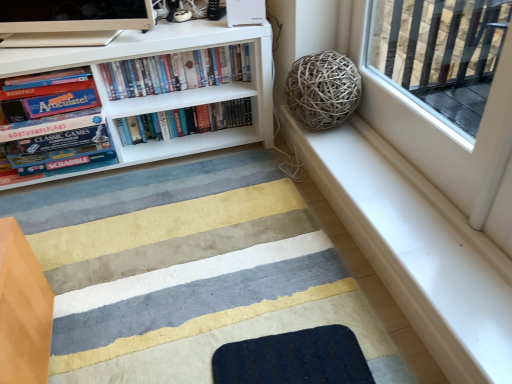
At what (x,y) coordinates should I click in order to perform the action: click on dark blue textured mat at lower center, which is the second doormat in front-to-back order. Please return your answer as a coordinate pair (x, y). The image size is (512, 384). Looking at the image, I should click on (294, 359).

How much space does dark blue textured mat at lower center, which is the second doormat in front-to-back order, occupy vertically?

1.82 centimeters.

What is the approximate width of white matte bookcase at upper left?

The width of white matte bookcase at upper left is 14.73 inches.

Identify the location of hardcover books at center, the 1th book viewed from the right. (188, 120).

Describe the element at coordinates (54, 125) in the screenshot. I see `matte board game at left, the third book in the right-to-left sequence` at that location.

Where is `dark blue textured mat at lower center, which ranks as the first doormat in back-to-front order`? The width and height of the screenshot is (512, 384). dark blue textured mat at lower center, which ranks as the first doormat in back-to-front order is located at coordinates (294, 359).

Is hardcover books at center, which is the third book from left to right, shorter than dark blue textured mat at lower center, which is the second doormat in front-to-back order?

Incorrect, the height of hardcover books at center, which is the third book from left to right, does not fall short of that of dark blue textured mat at lower center, which is the second doormat in front-to-back order.

From the image's perspective, which object appears higher, hardcover books at center, the 1th book viewed from the right, or dark blue textured mat at lower center, which ranks as the first doormat in back-to-front order?

hardcover books at center, the 1th book viewed from the right.

Can you confirm if hardcover books at center, the 1th book viewed from the right, is wider than dark blue textured mat at lower center, which ranks as the first doormat in back-to-front order?

Incorrect, the width of hardcover books at center, the 1th book viewed from the right, does not surpass that of dark blue textured mat at lower center, which ranks as the first doormat in back-to-front order.

Which object is further away from the camera, hardcover books at center, which is the third book from left to right, or dark blue textured mat at lower center, which is the second doormat in front-to-back order?

hardcover books at center, which is the third book from left to right.

Can you confirm if matte board game at left, the third book in the right-to-left sequence, is smaller than white matte bookcase at upper left?

Yes, matte board game at left, the third book in the right-to-left sequence, is smaller than white matte bookcase at upper left.

Which of these two, matte board game at left, the third book in the right-to-left sequence, or white matte bookcase at upper left, stands taller?

white matte bookcase at upper left is taller.

How different are the orientations of matte board game at left, arranged as the 1th book when viewed from the left, and white matte bookcase at upper left in degrees?

The angular difference between matte board game at left, arranged as the 1th book when viewed from the left, and white matte bookcase at upper left is 1.46 degrees.

Does point (105, 114) lie in front of point (112, 139)?

Yes, it is in front of point (112, 139).

From a real-world perspective, starting from the matte board game at left, arranged as the 1th book when viewed from the left, which doormat is the 2nd one below it? Please provide its 2D coordinates.

[(187, 270)]

Does matte board game at left, arranged as the 1th book when viewed from the left, have a lesser width compared to textured wool doormat at lower center, placed as the first doormat when sorted from front to back?

Correct, the width of matte board game at left, arranged as the 1th book when viewed from the left, is less than that of textured wool doormat at lower center, placed as the first doormat when sorted from front to back.

Between matte board game at left, arranged as the 1th book when viewed from the left, and textured wool doormat at lower center, placed as the first doormat when sorted from front to back, which one appears on the right side from the viewer's perspective?

textured wool doormat at lower center, placed as the first doormat when sorted from front to back.

Is point (158, 243) farther from viewer compared to point (78, 159)?

That is False.

Who is bigger, textured wool doormat at lower center, which is the second doormat in back-to-front order, or matte board game at left, arranged as the 1th book when viewed from the left?

Bigger between the two is matte board game at left, arranged as the 1th book when viewed from the left.

The image size is (512, 384). What are the coordinates of `the 3rd book counting from the left of the textured wool doormat at lower center, which is the second doormat in back-to-front order` in the screenshot? It's located at (54, 125).

Who is taller, textured wool doormat at lower center, which is the second doormat in back-to-front order, or matte board game at left, arranged as the 1th book when viewed from the left?

With more height is matte board game at left, arranged as the 1th book when viewed from the left.

The image size is (512, 384). What are the coordinates of `doormat that is the 2nd object located in front of the hardcover books at center, the 1th book viewed from the right` in the screenshot? It's located at (187, 270).

Based on the photo, are hardcover books at center, the 1th book viewed from the right, and textured wool doormat at lower center, placed as the first doormat when sorted from front to back, beside each other?

hardcover books at center, the 1th book viewed from the right, is not next to textured wool doormat at lower center, placed as the first doormat when sorted from front to back, and they're not touching.

From a real-world perspective, is hardcover books at center, which is the third book from left to right, on top of textured wool doormat at lower center, which is the second doormat in back-to-front order?

Indeed, from a real-world perspective, hardcover books at center, which is the third book from left to right, stands above textured wool doormat at lower center, which is the second doormat in back-to-front order.

Is hardcover books at center, the 1th book viewed from the right, facing towards textured wool doormat at lower center, placed as the first doormat when sorted from front to back?

Yes, hardcover books at center, the 1th book viewed from the right, is oriented towards textured wool doormat at lower center, placed as the first doormat when sorted from front to back.

Is dark blue textured mat at lower center, which ranks as the first doormat in back-to-front order, turned away from matte board game at left, the third book in the right-to-left sequence?

dark blue textured mat at lower center, which ranks as the first doormat in back-to-front order, is not turned away from matte board game at left, the third book in the right-to-left sequence.

Is there a large distance between dark blue textured mat at lower center, which is the second doormat in front-to-back order, and matte board game at left, arranged as the 1th book when viewed from the left?

Absolutely, dark blue textured mat at lower center, which is the second doormat in front-to-back order, is distant from matte board game at left, arranged as the 1th book when viewed from the left.

From a real-world perspective, which is physically below, dark blue textured mat at lower center, which ranks as the first doormat in back-to-front order, or matte board game at left, the third book in the right-to-left sequence?

dark blue textured mat at lower center, which ranks as the first doormat in back-to-front order, from a real-world perspective.

Based on the photo, considering the positions of objects dark blue textured mat at lower center, which ranks as the first doormat in back-to-front order, and matte board game at left, arranged as the 1th book when viewed from the left, in the image provided, who is more to the left, dark blue textured mat at lower center, which ranks as the first doormat in back-to-front order, or matte board game at left, arranged as the 1th book when viewed from the left,?

matte board game at left, arranged as the 1th book when viewed from the left.

Considering the sizes of white smooth window sill at upper right and textured wool doormat at lower center, placed as the first doormat when sorted from front to back, in the image, is white smooth window sill at upper right taller or shorter than textured wool doormat at lower center, placed as the first doormat when sorted from front to back,?

In the image, white smooth window sill at upper right appears to be taller than textured wool doormat at lower center, placed as the first doormat when sorted from front to back.

From a real-world perspective, which object stands above the other?

white smooth window sill at upper right is physically above.

Is white smooth window sill at upper right spatially inside textured wool doormat at lower center, placed as the first doormat when sorted from front to back, or outside of it?

white smooth window sill at upper right lies outside textured wool doormat at lower center, placed as the first doormat when sorted from front to back.

The height and width of the screenshot is (384, 512). There is a textured wool doormat at lower center, which is the second doormat in back-to-front order. What are the coordinates of `window sill above it (from a real-world perspective)` in the screenshot? It's located at (417, 248).

Locate an element on the screen. The image size is (512, 384). the 3rd book behind the dark blue textured mat at lower center, which ranks as the first doormat in back-to-front order is located at coordinates (188, 120).

The image size is (512, 384). Identify the location of bookcase above the matte board game at left, arranged as the 1th book when viewed from the left (from a real-world perspective). (167, 93).

Based on their spatial positions, is white smooth window sill at upper right or textured wool doormat at lower center, placed as the first doormat when sorted from front to back, closer to dark blue textured mat at lower center, which ranks as the first doormat in back-to-front order?

The object closer to dark blue textured mat at lower center, which ranks as the first doormat in back-to-front order, is textured wool doormat at lower center, placed as the first doormat when sorted from front to back.

Looking at the image, which one is located further to hardcover books at center, which is the third book from left to right, white smooth window sill at upper right or white matte bookcase at upper left?

white smooth window sill at upper right lies further to hardcover books at center, which is the third book from left to right, than the other object.

Considering their positions, is white smooth window sill at upper right positioned further to dark blue textured mat at lower center, which ranks as the first doormat in back-to-front order, than matte board game at left, arranged as the 1th book when viewed from the left?

Based on the image, matte board game at left, arranged as the 1th book when viewed from the left, appears to be further to dark blue textured mat at lower center, which ranks as the first doormat in back-to-front order.

Which object lies nearer to the anchor point dark blue textured mat at lower center, which ranks as the first doormat in back-to-front order, hardcover books at center, which is the third book from left to right, or matte board game at left, the third book in the right-to-left sequence?

matte board game at left, the third book in the right-to-left sequence, is positioned closer to the anchor dark blue textured mat at lower center, which ranks as the first doormat in back-to-front order.

Looking at the image, which one is located closer to white matte bookcase at upper left, white smooth window sill at upper right or dark blue textured mat at lower center, which is the second doormat in front-to-back order?

Based on the image, white smooth window sill at upper right appears to be nearer to white matte bookcase at upper left.

Looking at this image, based on their spatial positions, is dark blue textured mat at lower center, which is the second doormat in front-to-back order, or hardcover books at center, positioned as the 2th book in left-to-right order, closer to matte board game at left, arranged as the 1th book when viewed from the left?

The object closer to matte board game at left, arranged as the 1th book when viewed from the left, is hardcover books at center, positioned as the 2th book in left-to-right order.

Based on their spatial positions, is hardcover books at center, the 1th book viewed from the right, or matte board game at left, the third book in the right-to-left sequence, further from hardcover books at center, the second book in the right-to-left sequence?

matte board game at left, the third book in the right-to-left sequence, lies further to hardcover books at center, the second book in the right-to-left sequence, than the other object.

When comparing their distances from hardcover books at center, which is the third book from left to right, does white smooth window sill at upper right or dark blue textured mat at lower center, which is the second doormat in front-to-back order, seem further?

dark blue textured mat at lower center, which is the second doormat in front-to-back order.

Identify the location of bookcase between textured wool doormat at lower center, placed as the first doormat when sorted from front to back, and hardcover books at center, the second book in the right-to-left sequence, along the z-axis. (167, 93).

Image resolution: width=512 pixels, height=384 pixels. What are the coordinates of `window sill located between textured wool doormat at lower center, placed as the first doormat when sorted from front to back, and hardcover books at center, which is the third book from left to right, in the depth direction` in the screenshot? It's located at (417, 248).

Where is `bookcase between matte board game at left, the third book in the right-to-left sequence, and white smooth window sill at upper right`? bookcase between matte board game at left, the third book in the right-to-left sequence, and white smooth window sill at upper right is located at coordinates (167, 93).

The image size is (512, 384). What are the coordinates of `book located between textured wool doormat at lower center, which is the second doormat in back-to-front order, and hardcover books at center, the second book in the right-to-left sequence, in the depth direction` in the screenshot? It's located at (54, 125).